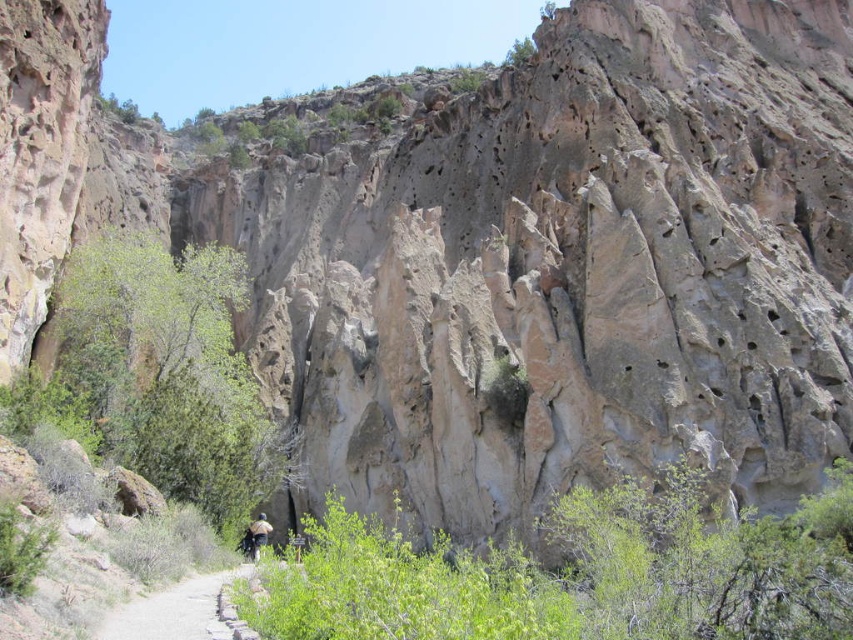
You are standing at the point marked as point (175, 611) in the image. What is directly under your feet?

The point (175, 611) is marked as gravel path at center, so the gravel path at center is directly under your feet.

You are standing on the gravel path at center and see the brown fabric backpack at center. Which object is closer to you?

The gravel path at center is in front of the brown fabric backpack at center, so the gravel path at center is closer to you.